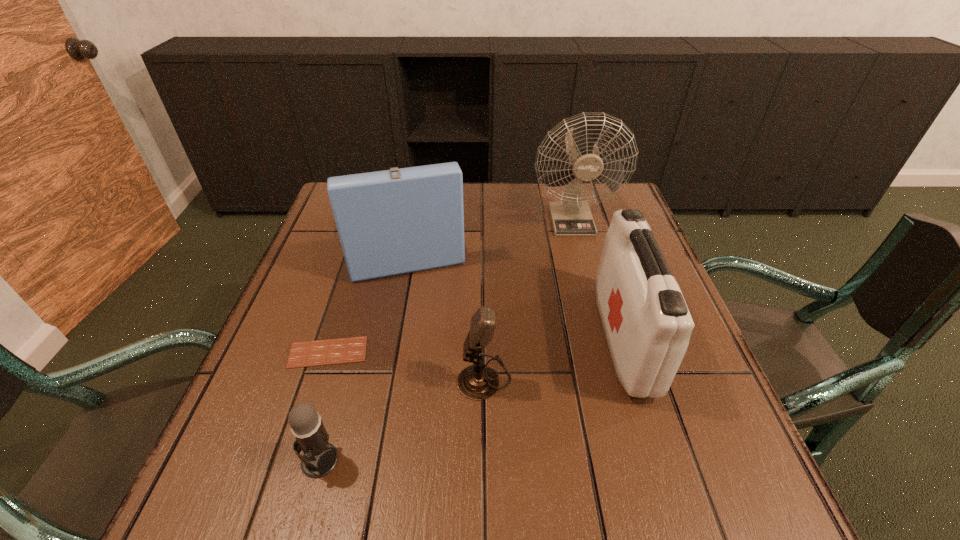
The height and width of the screenshot is (540, 960). I want to click on vacant region at the near edge of the desktop, so click(587, 495).

Image resolution: width=960 pixels, height=540 pixels. In the image, there is a desktop. Identify the location of vacant space at the left edge. (295, 287).

In the image, there is a desktop. Find the location of `vacant area at the right edge`. vacant area at the right edge is located at coordinates [645, 410].

The width and height of the screenshot is (960, 540). Identify the location of free space at the near left corner of the desktop. (302, 472).

This screenshot has height=540, width=960. In the image, there is a desktop. Identify the location of vacant space at the near right corner. (743, 508).

You are a GUI agent. You are given a task and a screenshot of the screen. Output one action in this format:
    pyautogui.click(x=<x>, y=<y>)
    Task: Click on the vacant region between the phonograph record and the taller microphone
    This screenshot has width=960, height=540.
    Given the screenshot: What is the action you would take?
    pyautogui.click(x=444, y=308)

At what (x,y) coordinates should I click in order to perform the action: click on free space between the fan and the phonograph record. Please return your answer as a coordinate pair (x, y). The width and height of the screenshot is (960, 540). Looking at the image, I should click on (487, 228).

Identify the location of empty location between the chocolate bar and the phonograph record. This screenshot has height=540, width=960. (365, 295).

Locate an element on the screen. This screenshot has width=960, height=540. vacant point located between the first-aid kit and the farther microphone is located at coordinates (554, 358).

Find the location of `free spot between the right microphone and the shortest object`. free spot between the right microphone and the shortest object is located at coordinates (406, 365).